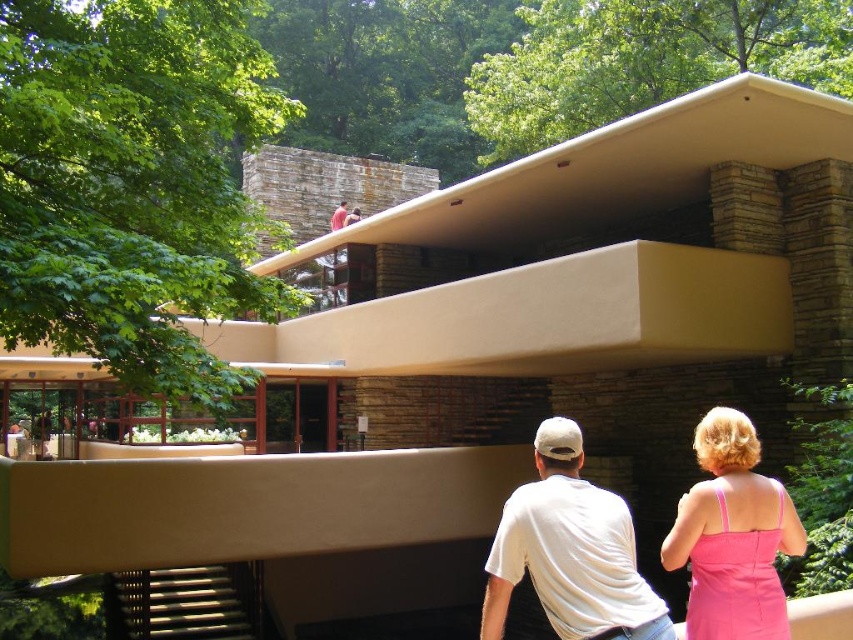
You are a visitor standing on the balcony and want to take a photo of both the pink satin dress at lower right and the matte stone man at upper center. Can you see both objects in your camera frame at the same time?

Yes, the pink satin dress at lower right is in front of matte stone man at upper center, so both can be seen in the camera frame simultaneously.